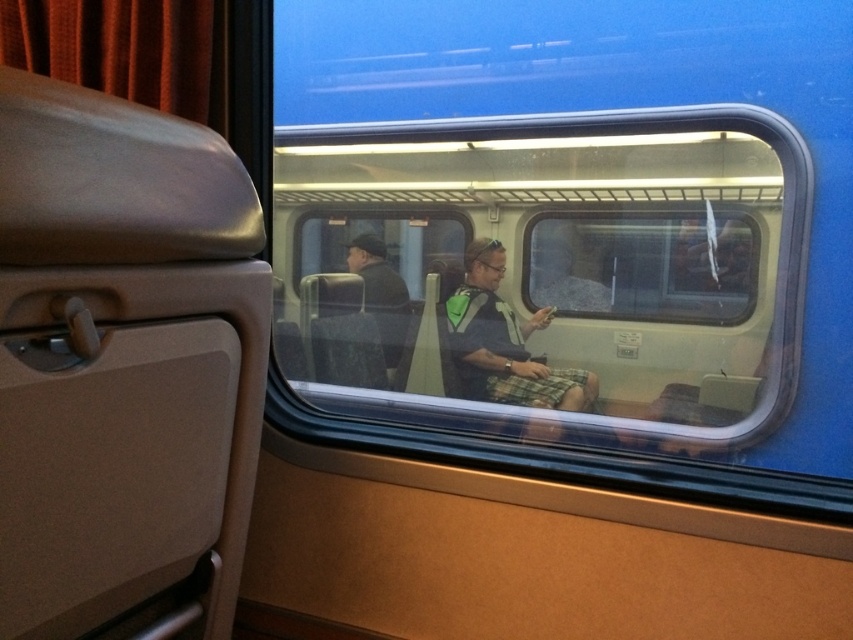
You are a passenger on the train and want to take a photo of the landscape outside through the transparent glass train window at center. However, there is a green fabric backpack at center in the way. Can you determine if the backpack is blocking the entire window?

The transparent glass train window at center might be wider than green fabric backpack at center, so there could be space on either side of the backpack to take a photo through the window without obstruction.

You are a passenger on the train and want to check the time on your phone. You have your green fabric backpack at center and the transparent glass train window at center in front of you. Which object should you use to see your phone screen more clearly?

The transparent glass train window at center is bigger than the green fabric backpack at center, so you should use the transparent glass train window at center to see your phone screen more clearly because its larger size allows for better visibility.

You are inside a train car and want to look outside through the transparent glass train window at center. According to the coordinates provided, where should you look to see the window?

The transparent glass train window at center is located at coordinates point (566, 266), so you should look towards that position to see the window.